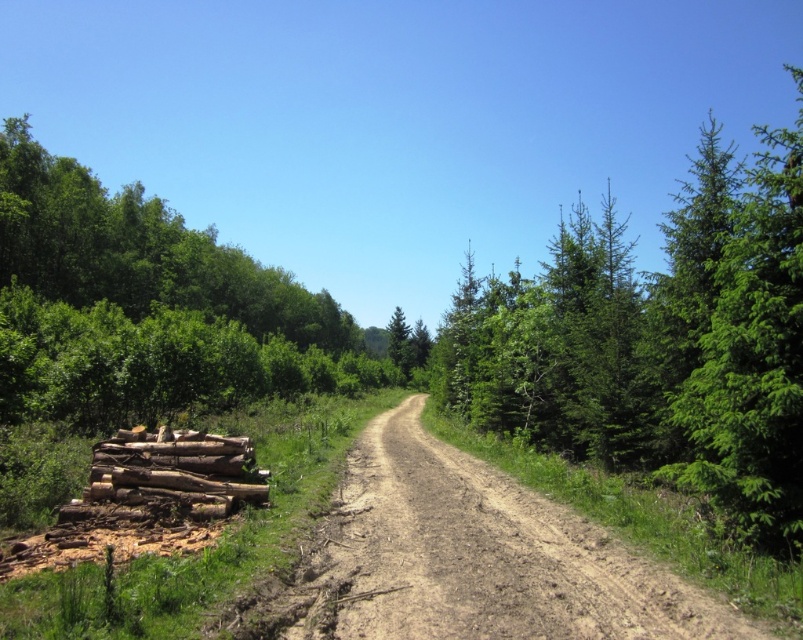
Question: Is green needle-like trees at right below brown rough wood at lower left?

Choices:
 (A) yes
 (B) no

Answer: (B)

Question: Which point is farther from the camera taking this photo?

Choices:
 (A) (x=691, y=371)
 (B) (x=186, y=458)

Answer: (B)

Question: Which of the following is the farthest from the observer?

Choices:
 (A) green needle-like trees at right
 (B) brown rough wood at lower left

Answer: (B)

Question: Does green needle-like trees at right appear over brown rough wood at lower left?

Choices:
 (A) no
 (B) yes

Answer: (B)

Question: Observing the image, what is the correct spatial positioning of green needle-like trees at right in reference to brown rough wood at lower left?

Choices:
 (A) left
 (B) right

Answer: (B)